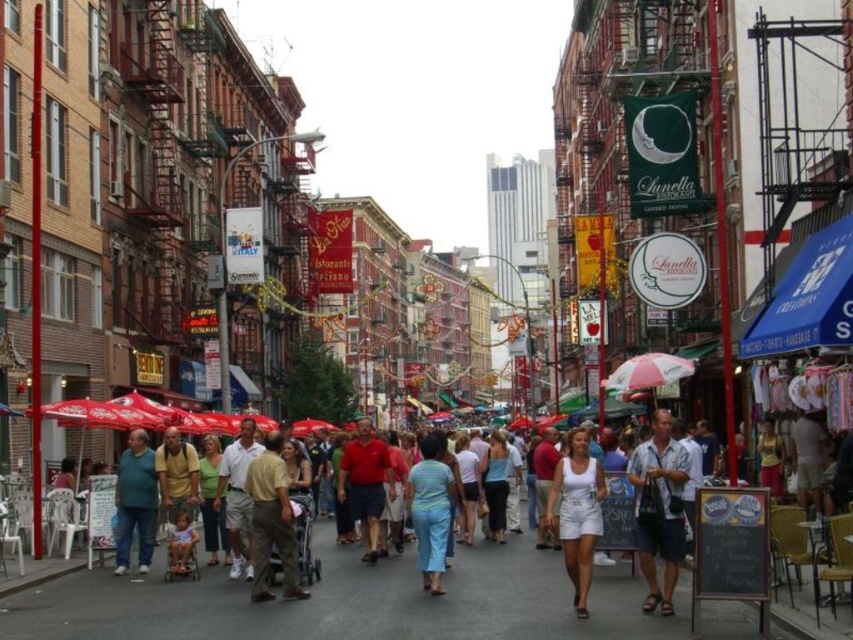
Question: Is striped fabric pants at center positioned behind light brown shorts at center?

Choices:
 (A) yes
 (B) no

Answer: (B)

Question: Is matte green shirt at center thinner than matte pink umbrella at center?

Choices:
 (A) no
 (B) yes

Answer: (A)

Question: Based on their relative distances, which object is farther from the light brown shorts at center?

Choices:
 (A) striped fabric pants at center
 (B) light blue denim shorts at center

Answer: (A)

Question: Is light blue denim shorts at center bigger than metallic stroller at center?

Choices:
 (A) yes
 (B) no

Answer: (A)

Question: Among these objects, which one is nearest to the camera?

Choices:
 (A) blue fabric canopy at right
 (B) metallic stroller at center

Answer: (B)

Question: Which point appears closest to the camera in this image?

Choices:
 (A) (792, 452)
 (B) (352, 440)

Answer: (A)